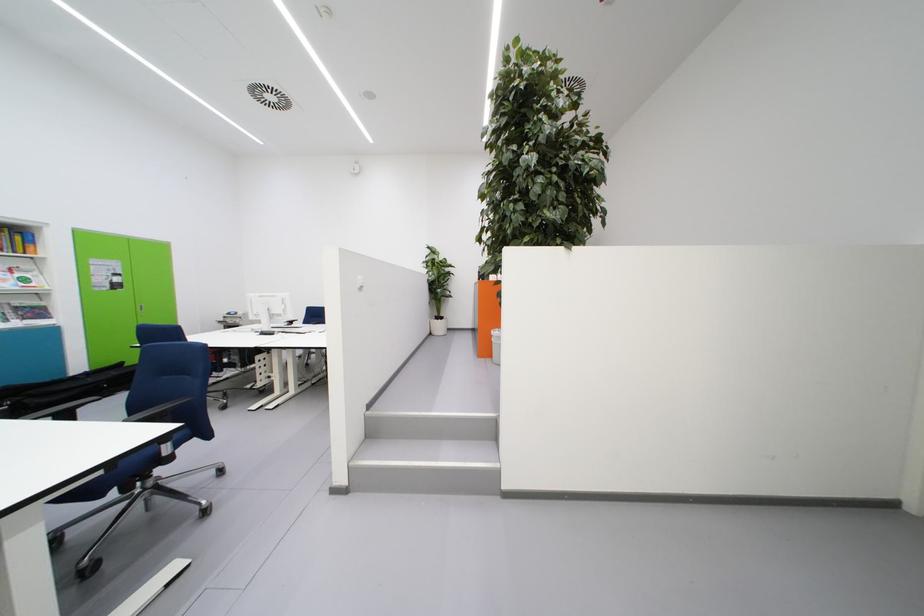
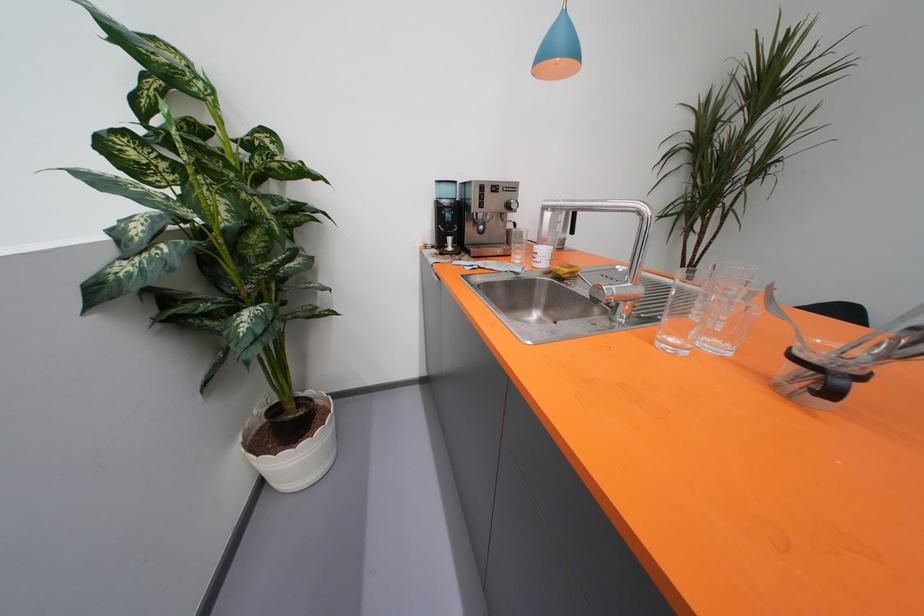
Question: What movement of the cameraman would produce the second image?

Choices:
 (A) Left
 (B) Right
 (C) Forward
 (D) Backward

Answer: (C)